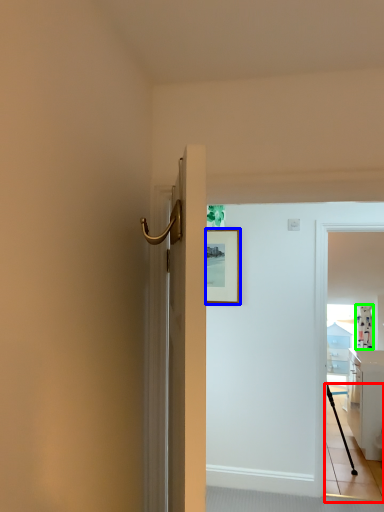
Question: Considering the real-world distances, which object is farthest from path (highlighted by a red box)? picture frame (highlighted by a blue box) or curtain (highlighted by a green box)?

Choices:
 (A) picture frame
 (B) curtain

Answer: (A)